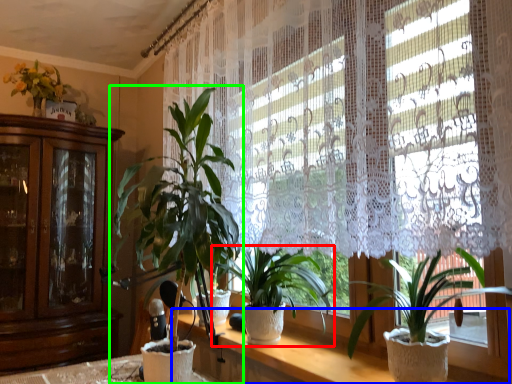
Question: Which object is positioned farthest from houseplant (highlighted by a red box)? Select from vanity (highlighted by a blue box) and houseplant (highlighted by a green box).

Choices:
 (A) vanity
 (B) houseplant

Answer: (B)